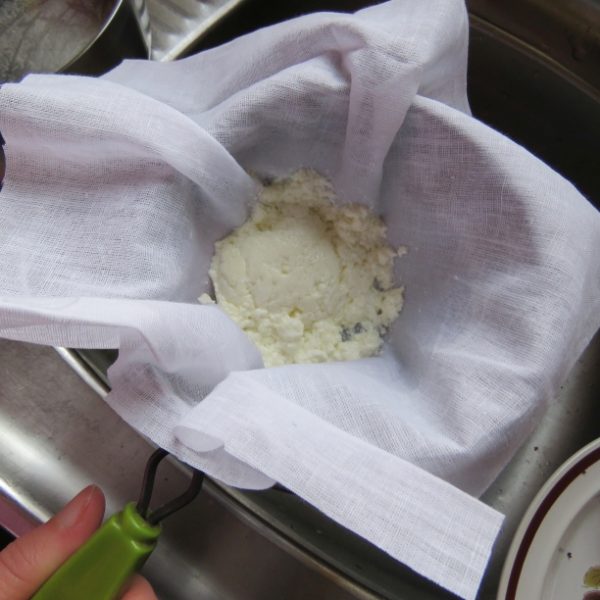
Locate an element on the screen. This screenshot has height=600, width=600. grayish white cloth is located at coordinates (364, 466).